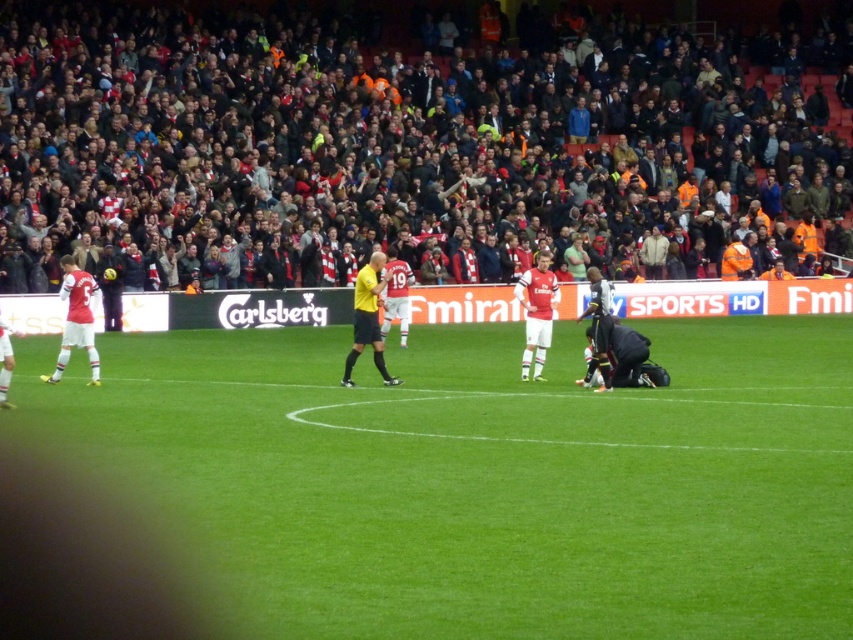
Question: Among these objects, which one is farthest from the camera?

Choices:
 (A) white jersey at center
 (B) dark gray fabric crowd at upper center
 (C) yellow uniformed official at center

Answer: (B)

Question: Among these points, which one is nearest to the camera?

Choices:
 (A) (103, 22)
 (B) (62, 364)

Answer: (B)

Question: Among these points, which one is farthest from the camera?

Choices:
 (A) (96, 356)
 (B) (543, 352)
 (C) (360, 320)

Answer: (B)

Question: Does white jersey at left appear on the left side of white jersey at center?

Choices:
 (A) yes
 (B) no

Answer: (A)

Question: Is dark gray fabric crowd at upper center above yellow uniformed official at center?

Choices:
 (A) yes
 (B) no

Answer: (A)

Question: Can you confirm if green grass field at center is positioned below yellow uniformed official at center?

Choices:
 (A) yes
 (B) no

Answer: (A)